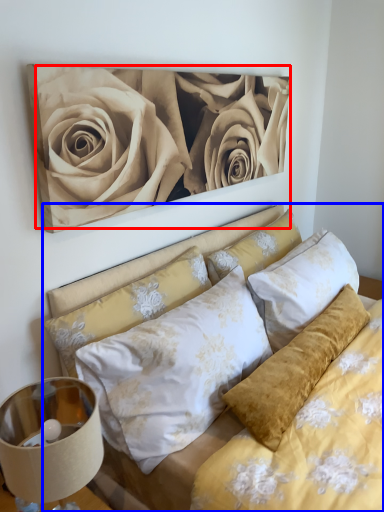
Question: Which object appears closest to the camera in this image, rose (highlighted by a red box) or bed (highlighted by a blue box)?

Choices:
 (A) rose
 (B) bed

Answer: (B)